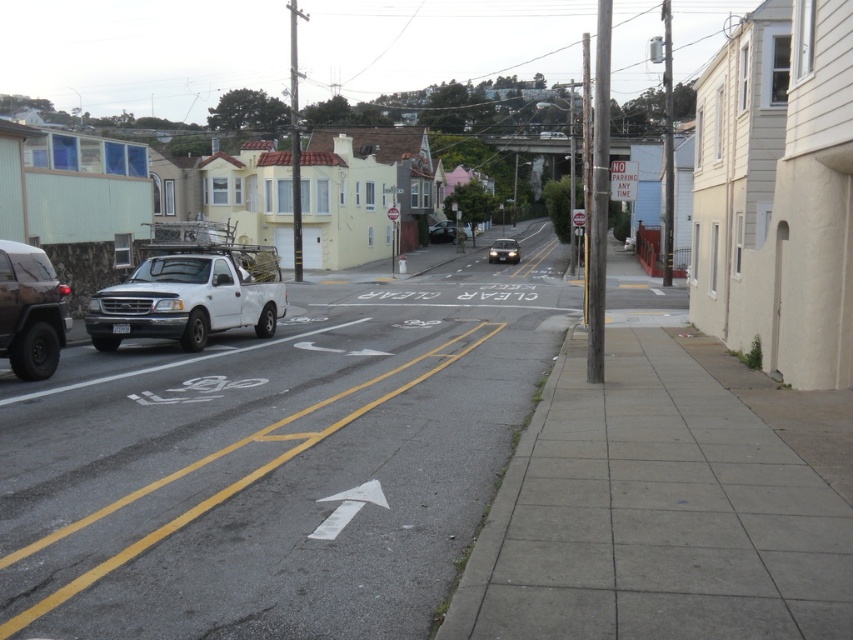
Question: Is matte black suv at left further to the viewer compared to shiny silver sedan at center?

Choices:
 (A) no
 (B) yes

Answer: (A)

Question: Can you confirm if white matte truck at left is positioned to the right of shiny black sedan at center?

Choices:
 (A) no
 (B) yes

Answer: (A)

Question: Which point appears farthest from the camera in this image?

Choices:
 (A) (102, 292)
 (B) (450, 241)
 (C) (492, 259)

Answer: (B)

Question: Which point is closer to the camera?

Choices:
 (A) (28, 257)
 (B) (445, 225)

Answer: (A)

Question: Which point is farther to the camera?

Choices:
 (A) matte black suv at left
 (B) shiny silver sedan at center
 (C) shiny black sedan at center

Answer: (C)

Question: Is gray asphalt at center below matte black suv at left?

Choices:
 (A) no
 (B) yes

Answer: (B)